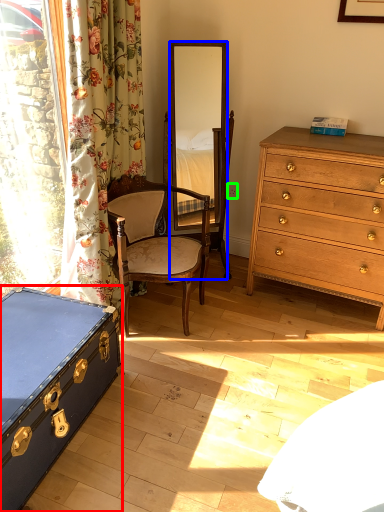
Question: Which is nearer to the box (highlighted by a red box)? mirror (highlighted by a blue box) or power outlet (highlighted by a green box).

Choices:
 (A) mirror
 (B) power outlet

Answer: (B)